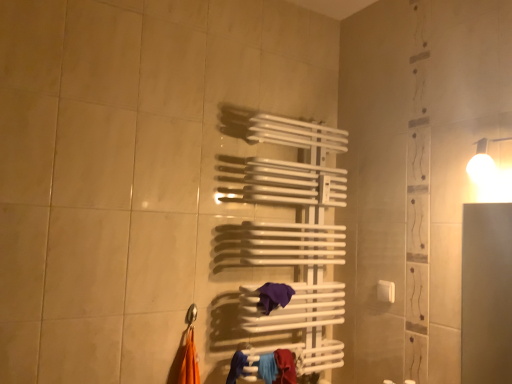
Locate an element on the screen. The image size is (512, 384). purple matte towel at center is located at coordinates (274, 296).

What do you see at coordinates (274, 296) in the screenshot?
I see `purple matte towel at center` at bounding box center [274, 296].

You are a GUI agent. You are given a task and a screenshot of the screen. Output one action in this format:
    pyautogui.click(x=<x>, y=<y>)
    Task: Click on the purple matte towel at center
    
    Given the screenshot: What is the action you would take?
    pyautogui.click(x=274, y=296)